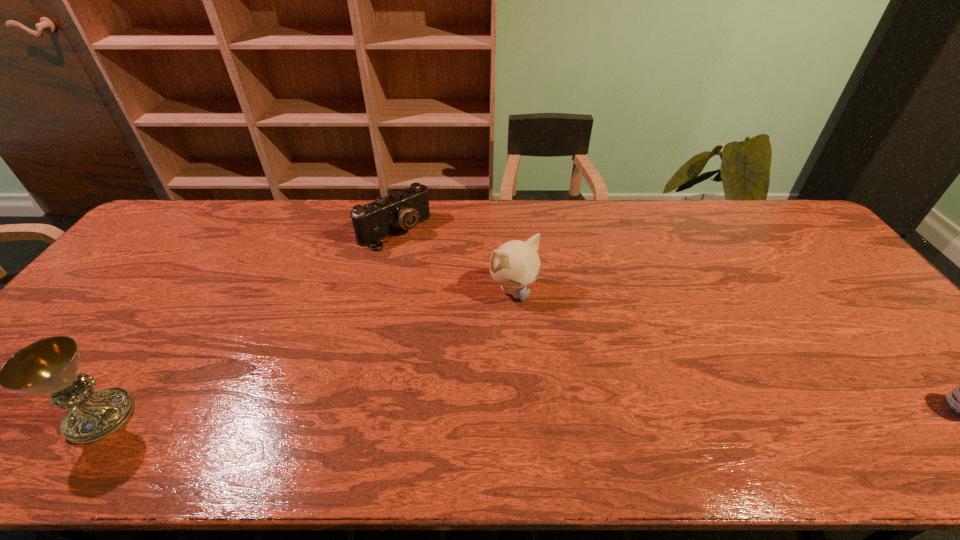
Image resolution: width=960 pixels, height=540 pixels. In order to click on vacant region located on the front-facing side of the farthest object in this screenshot , I will do `click(436, 268)`.

The image size is (960, 540). In order to click on vacant region located on the front-facing side of the farthest object in this screenshot , I will do `click(436, 268)`.

This screenshot has height=540, width=960. I want to click on object that is at the far edge, so click(402, 210).

The height and width of the screenshot is (540, 960). Identify the location of object that is at the near edge. (49, 366).

The height and width of the screenshot is (540, 960). Identify the location of free spot at the far edge of the desktop. (478, 219).

This screenshot has width=960, height=540. In order to click on vacant space at the near edge of the desktop in this screenshot , I will do `click(669, 395)`.

In the image, there is a desktop. Identify the location of vacant space at the left edge. (131, 259).

What are the coordinates of `vacant space at the near left corner of the desktop` in the screenshot? It's located at (50, 408).

Identify the location of free space at the far right corner of the desktop. (769, 211).

The width and height of the screenshot is (960, 540). I want to click on free space between the farthest object and the second tallest object, so 454,260.